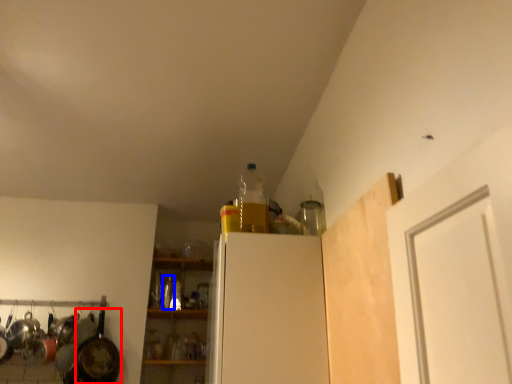
Question: Among these objects, which one is farthest to the camera, frying pan (highlighted by a red box) or bottle (highlighted by a blue box)?

Choices:
 (A) frying pan
 (B) bottle

Answer: (B)